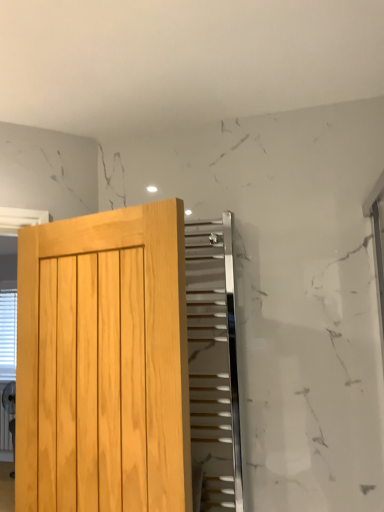
Question: From the image's perspective, is polished chrome radiator at upper center located above or below light wood door at left?

Choices:
 (A) above
 (B) below

Answer: (B)

Question: In terms of height, does polished chrome radiator at upper center look taller or shorter compared to light wood door at left?

Choices:
 (A) tall
 (B) short

Answer: (A)

Question: Which of these objects is positioned farthest from the polished chrome radiator at upper center?

Choices:
 (A) light wood door at left
 (B) white plastic blinds at left

Answer: (B)

Question: Which object is positioned closest to the light wood door at left?

Choices:
 (A) polished chrome radiator at upper center
 (B) white plastic blinds at left

Answer: (B)